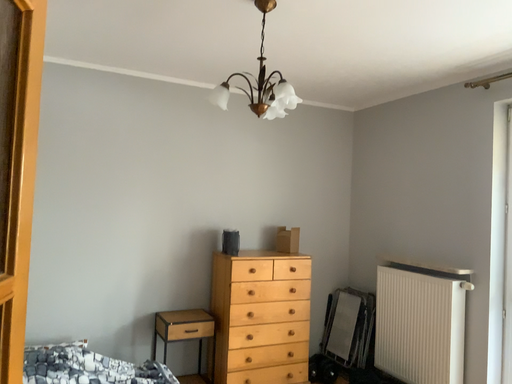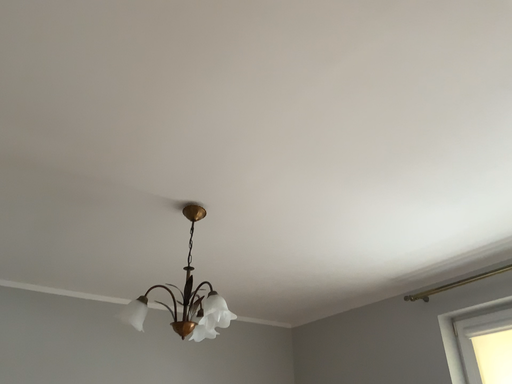
Question: How did the camera likely rotate when shooting the video?

Choices:
 (A) rotated upward
 (B) rotated downward

Answer: (A)